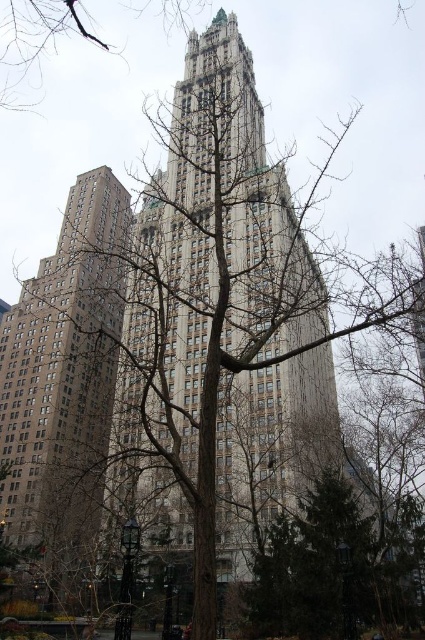
Question: Does gray stone tower at center come in front of bare branches at upper center?

Choices:
 (A) no
 (B) yes

Answer: (B)

Question: Is beige stone building at left wider than bare branches at upper center?

Choices:
 (A) no
 (B) yes

Answer: (A)

Question: Which object is the closest to the bare branches at upper center?

Choices:
 (A) beige stone building at left
 (B) gray stone tower at center

Answer: (A)

Question: Is gray stone tower at center in front of bare branches at upper center?

Choices:
 (A) no
 (B) yes

Answer: (B)

Question: Estimate the real-world distances between objects in this image. Which object is closer to the beige stone building at left?

Choices:
 (A) gray stone tower at center
 (B) bare branches at upper center

Answer: (A)

Question: Which object is farther from the camera taking this photo?

Choices:
 (A) bare branches at upper center
 (B) gray stone tower at center
 (C) beige stone building at left

Answer: (A)